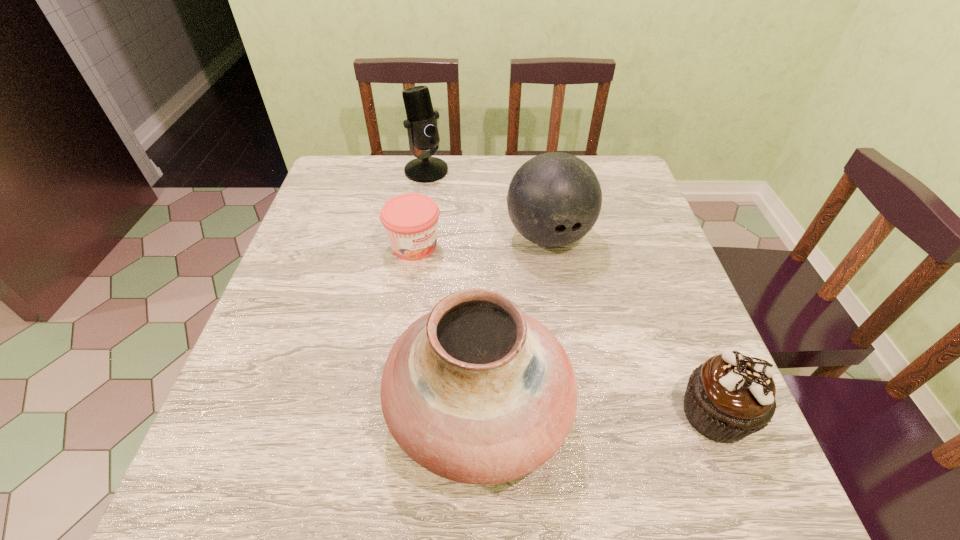
This screenshot has width=960, height=540. Find the location of `free spot on the desktop that is between the pottery and the rightmost object and is positioned on the front label of the jam`. free spot on the desktop that is between the pottery and the rightmost object and is positioned on the front label of the jam is located at coordinates (611, 412).

The width and height of the screenshot is (960, 540). I want to click on vacant space on the desktop that is between the pottery and the second shortest object and is positioned on the stand of the farthest object, so coord(577,411).

Find the location of a particular element. The height and width of the screenshot is (540, 960). free space on the desktop that is between the pottery and the second shortest object and is positioned on the grip area of the bowling ball is located at coordinates (633, 413).